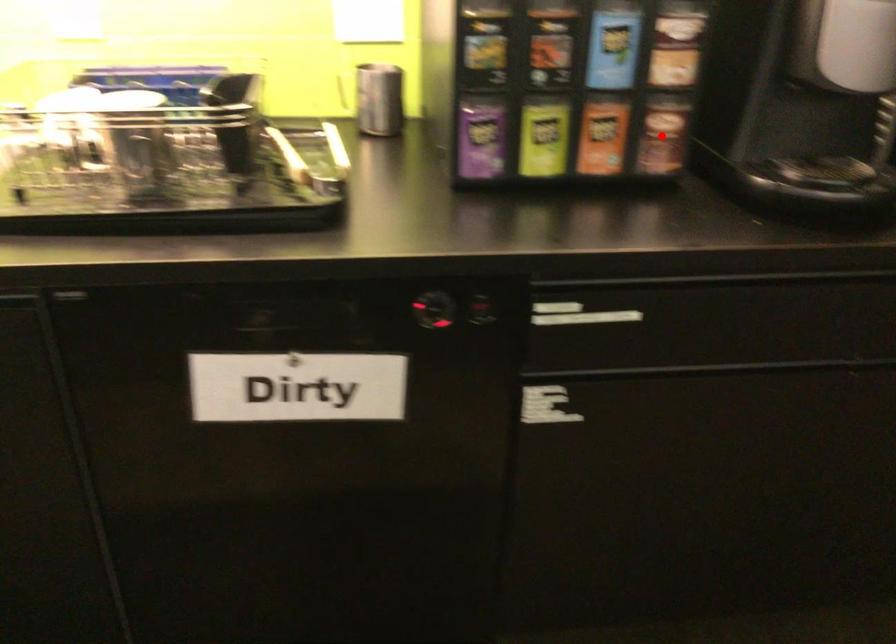
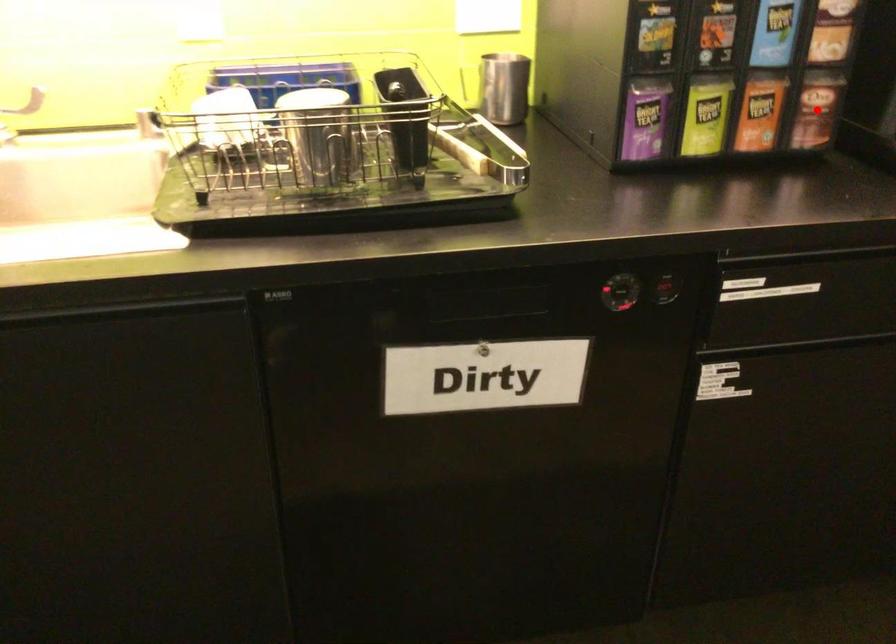
I am providing you with two images of the same scene from different viewpoints. A red point is marked on the first image and another point is marked on the second image. Do the highlighted points in image1 and image2 indicate the same real-world spot?

Yes